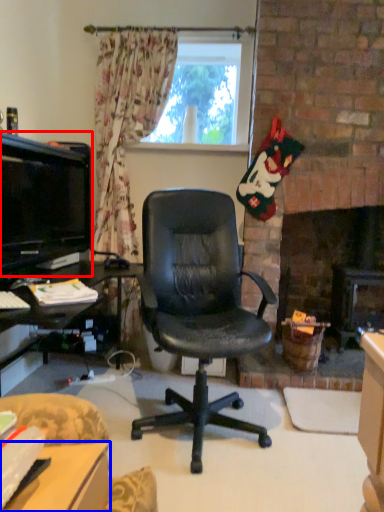
Question: Which of the following is the farthest to the observer, television (highlighted by a red box) or desk (highlighted by a blue box)?

Choices:
 (A) television
 (B) desk

Answer: (A)